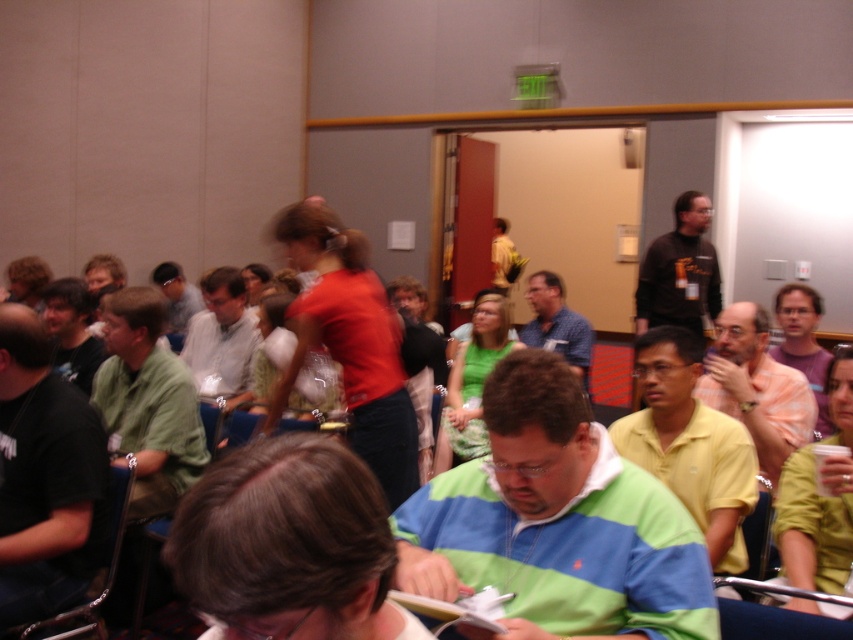
Is green striped shirt at center shorter than matte white shirt at center?

Yes.

Can you confirm if green striped shirt at center is positioned below matte white shirt at center?

Yes.

Does point (204, 548) lie in front of point (193, 308)?

Yes.

Identify the location of green striped shirt at center. (288, 545).

Does green matte shirt at left have a greater width compared to light gray shirt at center?

Yes.

Between point (131, 420) and point (186, 348), which one is positioned in front?

Point (131, 420) is more forward.

This screenshot has width=853, height=640. Describe the element at coordinates (148, 403) in the screenshot. I see `green matte shirt at left` at that location.

Where is `green matte shirt at left`? green matte shirt at left is located at coordinates pyautogui.click(x=148, y=403).

Is point (364, 522) closer to camera compared to point (712, 269)?

That is True.

Is green striped shirt at center wider than dark brown sweater at upper right?

No, green striped shirt at center is not wider than dark brown sweater at upper right.

Between point (346, 518) and point (701, 266), which one is positioned behind?

The point (701, 266) is behind.

Identify the location of green striped shirt at center. This screenshot has height=640, width=853. (288, 545).